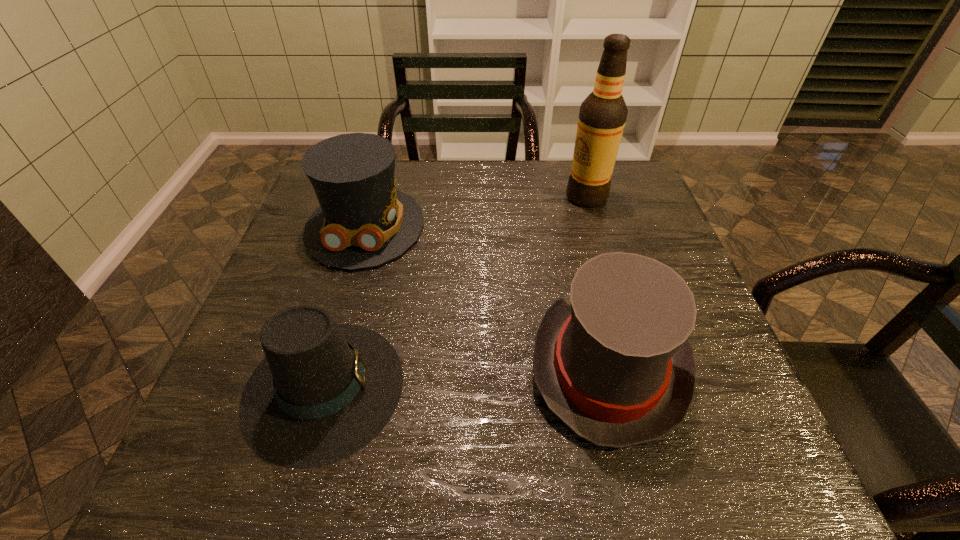
Identify the location of the tallest object. (602, 117).

Locate an element on the screen. The image size is (960, 540). the farthest hat is located at coordinates (363, 221).

Find the location of `the rightmost hat`. the rightmost hat is located at coordinates (612, 361).

Locate an element on the screen. The width and height of the screenshot is (960, 540). vacant space located 0.290m on the label of the alcohol is located at coordinates (463, 197).

Locate an element on the screen. This screenshot has width=960, height=540. blank area located on the label of the alcohol is located at coordinates (505, 197).

This screenshot has height=540, width=960. In order to click on vacant area situated on the label of the alcohol in this screenshot , I will do `click(438, 197)`.

Where is `vacant space located with goggles on the front of the farthest hat`? vacant space located with goggles on the front of the farthest hat is located at coordinates (319, 386).

Locate an element on the screen. The width and height of the screenshot is (960, 540). free space located on the left of the rightmost hat is located at coordinates (431, 366).

You are a GUI agent. You are given a task and a screenshot of the screen. Output one action in this format:
    pyautogui.click(x=<x>, y=<y>)
    Task: Click on the alcohol present at the far edge
    The height and width of the screenshot is (540, 960).
    Given the screenshot: What is the action you would take?
    pyautogui.click(x=602, y=117)

This screenshot has width=960, height=540. Identify the location of dress hat that is at the far edge. (363, 221).